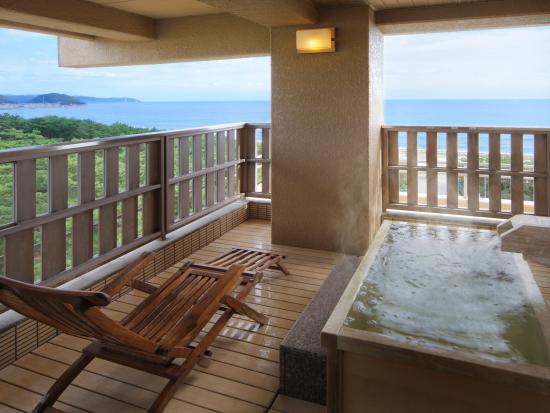
You are a GUI agent. You are given a task and a screenshot of the screen. Output one action in this format:
    pyautogui.click(x=<x>, y=<y>)
    Task: Click on the support column
    This screenshot has width=550, height=413.
    Given the screenshot: What is the action you would take?
    pyautogui.click(x=332, y=115)